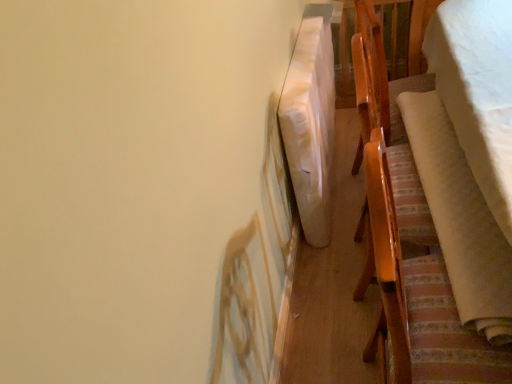
Question: Is wooden chair at right at the left side of white fabric blanket at upper right, which is the first blanket in left-to-right order?

Choices:
 (A) no
 (B) yes

Answer: (A)

Question: From a real-world perspective, is wooden chair at right physically below white fabric blanket at upper right, which is the first blanket in left-to-right order?

Choices:
 (A) yes
 (B) no

Answer: (B)

Question: Is wooden chair at right thinner than white fabric blanket at upper right, the 3th blanket viewed from the right?

Choices:
 (A) no
 (B) yes

Answer: (A)

Question: Is the position of wooden chair at right less distant than that of white fabric blanket at upper right, which is the first blanket in left-to-right order?

Choices:
 (A) yes
 (B) no

Answer: (A)

Question: Can we say wooden chair at right lies outside white fabric blanket at upper right, the 3th blanket viewed from the right?

Choices:
 (A) no
 (B) yes

Answer: (B)

Question: Considering the relative sizes of wooden chair at right and white fabric blanket at upper right, which is the first blanket in left-to-right order, in the image provided, is wooden chair at right wider than white fabric blanket at upper right, which is the first blanket in left-to-right order,?

Choices:
 (A) no
 (B) yes

Answer: (B)

Question: Is white soft blanket at right, the second blanket when ordered from left to right, positioned far away from white soft blanket at right, acting as the 3th blanket starting from the left?

Choices:
 (A) no
 (B) yes

Answer: (A)

Question: Is white soft blanket at right, the second blanket when ordered from left to right, not within white soft blanket at right, the 1th blanket positioned from the right?

Choices:
 (A) yes
 (B) no

Answer: (B)

Question: Is white soft blanket at right, the second blanket when ordered from left to right, oriented towards white soft blanket at right, acting as the 3th blanket starting from the left?

Choices:
 (A) yes
 (B) no

Answer: (A)

Question: Can you confirm if white soft blanket at right, which ranks as the 2th blanket in right-to-left order, is taller than white soft blanket at right, the 1th blanket positioned from the right?

Choices:
 (A) no
 (B) yes

Answer: (A)

Question: Is white soft blanket at right, the second blanket when ordered from left to right, further to the viewer compared to white soft blanket at right, the 1th blanket positioned from the right?

Choices:
 (A) no
 (B) yes

Answer: (B)

Question: From a real-world perspective, does white soft blanket at right, which ranks as the 2th blanket in right-to-left order, stand above white soft blanket at right, acting as the 3th blanket starting from the left?

Choices:
 (A) no
 (B) yes

Answer: (B)

Question: Is white fabric blanket at upper right, which is the first blanket in left-to-right order, closer to camera compared to white soft blanket at right, which ranks as the 2th blanket in right-to-left order?

Choices:
 (A) yes
 (B) no

Answer: (B)